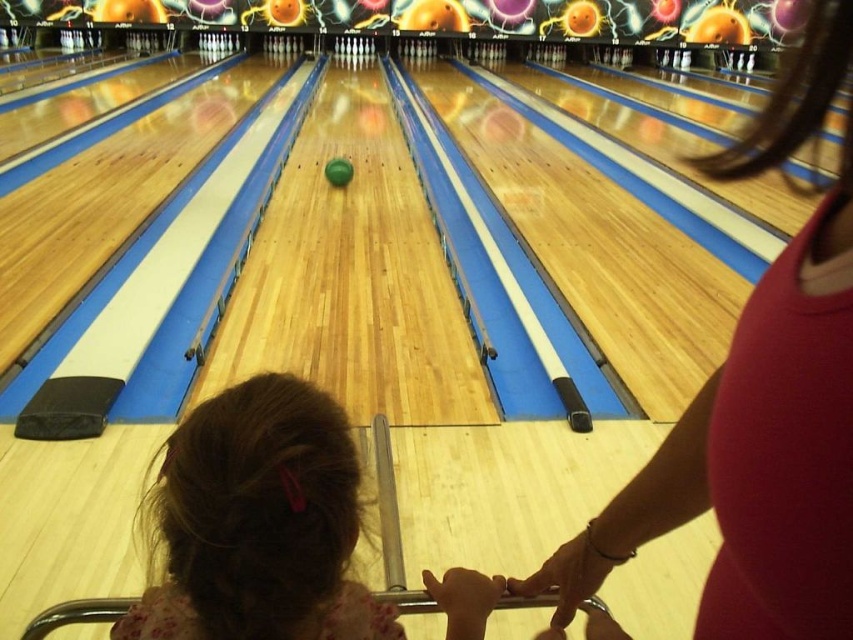
Question: Estimate the real-world distances between objects in this image. Which object is closer to the green matte bowling ball at center?

Choices:
 (A) brown hair at center
 (B) pink fabric at upper right

Answer: (B)

Question: From the image, what is the correct spatial relationship of brown hair at center in relation to green matte bowling ball at center?

Choices:
 (A) right
 (B) left

Answer: (A)

Question: Which point is closer to the camera?

Choices:
 (A) (843, 269)
 (B) (262, 419)

Answer: (A)

Question: Does brown hair at center have a larger size compared to green matte bowling ball at center?

Choices:
 (A) no
 (B) yes

Answer: (B)

Question: Does pink fabric at upper right appear on the right side of green matte bowling ball at center?

Choices:
 (A) no
 (B) yes

Answer: (B)

Question: Among these objects, which one is nearest to the camera?

Choices:
 (A) pink fabric at upper right
 (B) brown hair at center

Answer: (A)